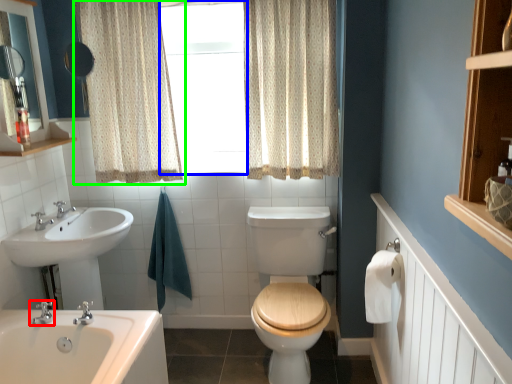
Question: Estimate the real-world distances between objects in this image. Which object is closer to tap (highlighted by a red box), window frame (highlighted by a blue box) or curtain (highlighted by a green box)?

Choices:
 (A) window frame
 (B) curtain

Answer: (B)